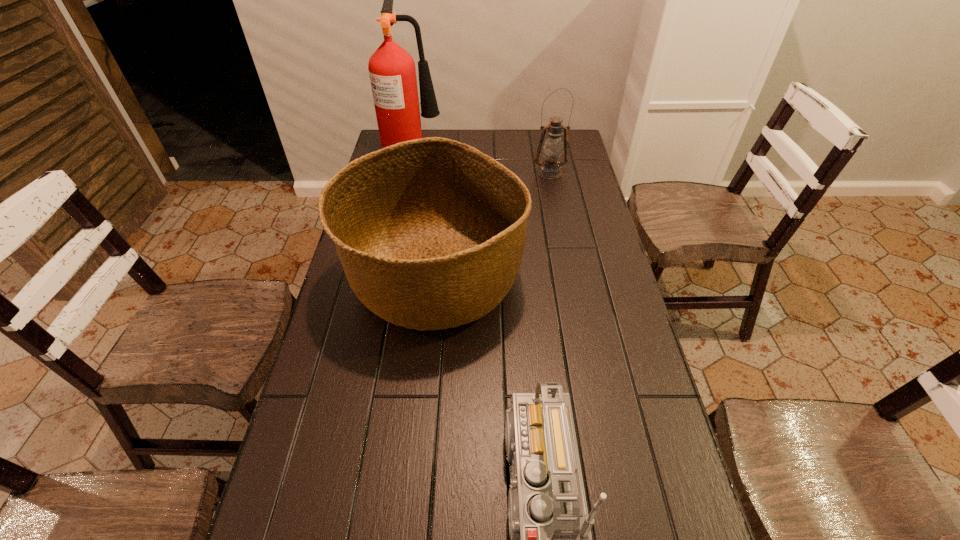
This screenshot has width=960, height=540. I want to click on vacant space that satisfies the following two spatial constraints: 1. at the nozzle of the farthest object; 2. on the left side of the rightmost object, so (x=407, y=173).

The image size is (960, 540). I want to click on free point that satisfies the following two spatial constraints: 1. at the nozzle of the farthest object; 2. on the back side of the basket, so (x=386, y=278).

The image size is (960, 540). Identify the location of vacant space that satisfies the following two spatial constraints: 1. at the nozzle of the fire extinguisher; 2. on the left side of the basket. (386, 278).